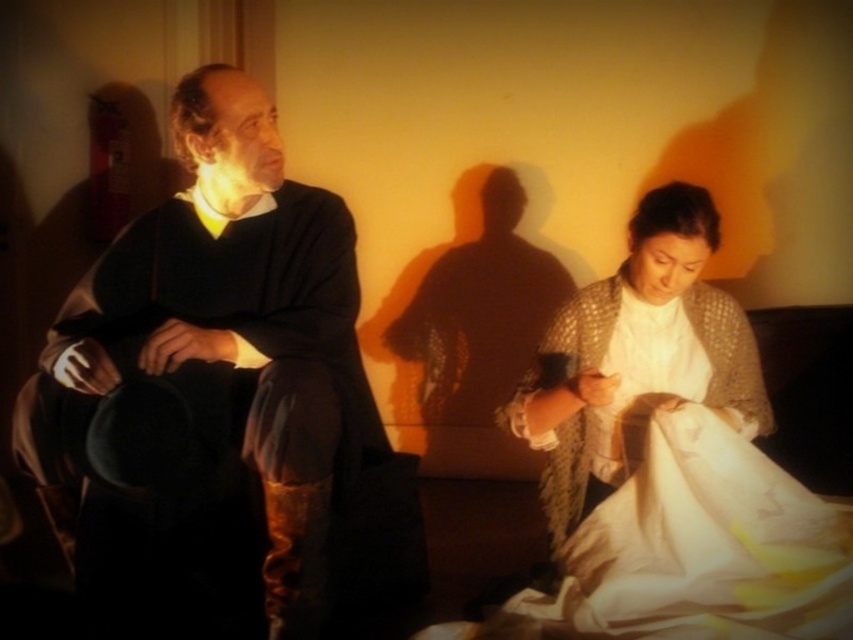
Where is `matte black hat at left`? matte black hat at left is located at coordinates (215, 349).

From the picture: Is matte black hat at left further to the viewer compared to white textured shawl at lower right?

No, it is in front of white textured shawl at lower right.

What do you see at coordinates (215, 349) in the screenshot? I see `matte black hat at left` at bounding box center [215, 349].

This screenshot has width=853, height=640. Identify the location of matte black hat at left. (215, 349).